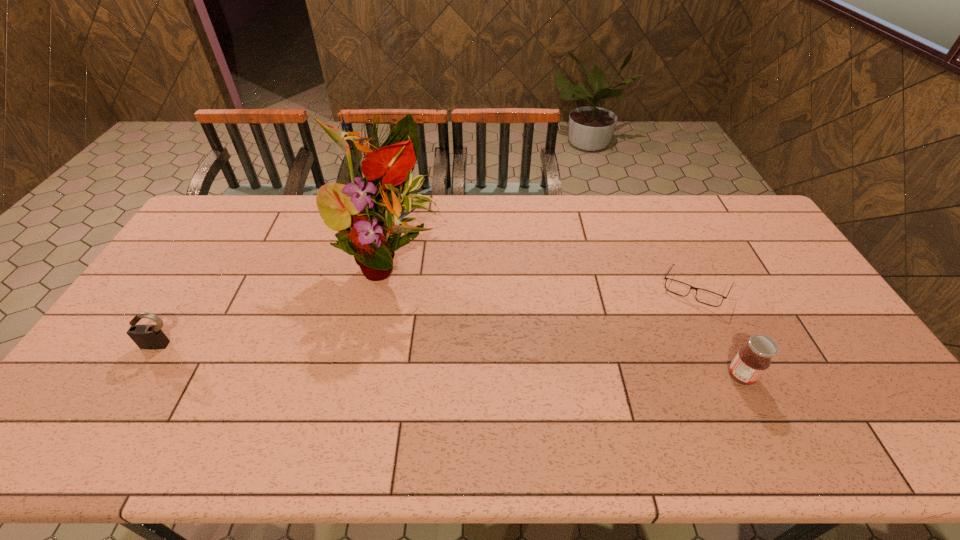
Locate an element on the screen. Image resolution: width=960 pixels, height=540 pixels. free space on the desktop that is between the leftmost object and the jam and is positioned on the front-facing side of the tallest object is located at coordinates (389, 357).

The width and height of the screenshot is (960, 540). I want to click on vacant spot on the desktop that is between the padlock and the nearest object and is positioned with the lenses facing outward on the spectacles, so click(x=525, y=364).